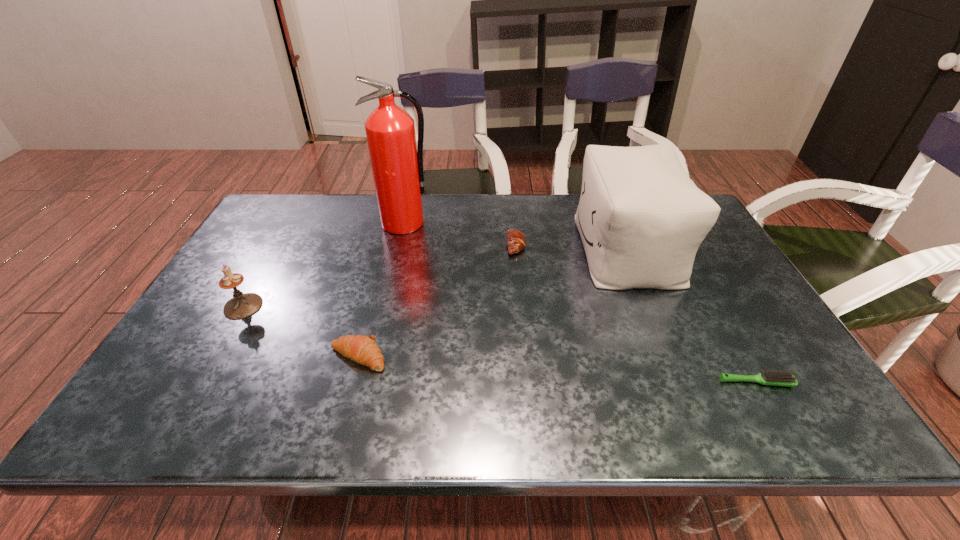
This screenshot has width=960, height=540. Identify the location of crescent roll that is at the far edge. (516, 241).

You are a GUI agent. You are given a task and a screenshot of the screen. Output one action in this format:
    pyautogui.click(x=<x>, y=<y>)
    Task: Click on the object that is at the left edge
    This screenshot has height=540, width=960.
    Given the screenshot: What is the action you would take?
    point(241,305)

This screenshot has width=960, height=540. In order to click on cushion positioned at the right edge in this screenshot , I will do `click(641, 219)`.

At what (x,y) coordinates should I click in order to perform the action: click on hairbrush positioned at the right edge. Please return your answer as a coordinate pair (x, y). The image size is (960, 540). Looking at the image, I should click on (777, 378).

Where is `object situated at the far right corner`? This screenshot has width=960, height=540. object situated at the far right corner is located at coordinates (641, 219).

In the image, there is a desktop. Where is `vacant area at the far edge`? The height and width of the screenshot is (540, 960). vacant area at the far edge is located at coordinates (357, 221).

In order to click on free location at the near edge in this screenshot , I will do `click(682, 397)`.

The image size is (960, 540). In the image, there is a desktop. What are the coordinates of `free space at the left edge` in the screenshot? It's located at (258, 279).

In the image, there is a desktop. Where is `vacant space at the far left corner`? This screenshot has height=540, width=960. vacant space at the far left corner is located at coordinates (282, 230).

Find the location of a particular element. The width and height of the screenshot is (960, 540). vacant point located between the tallest object and the nearer crescent roll is located at coordinates (381, 290).